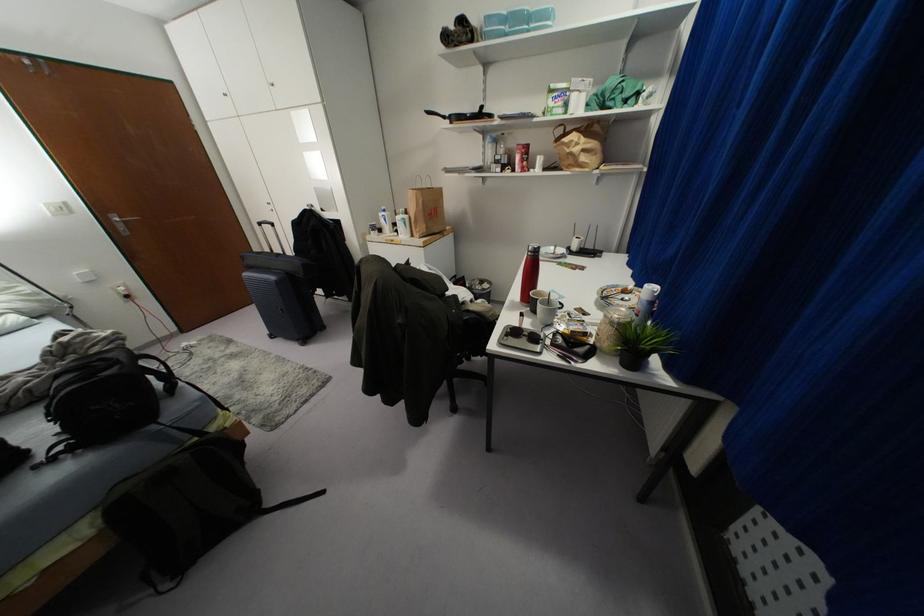
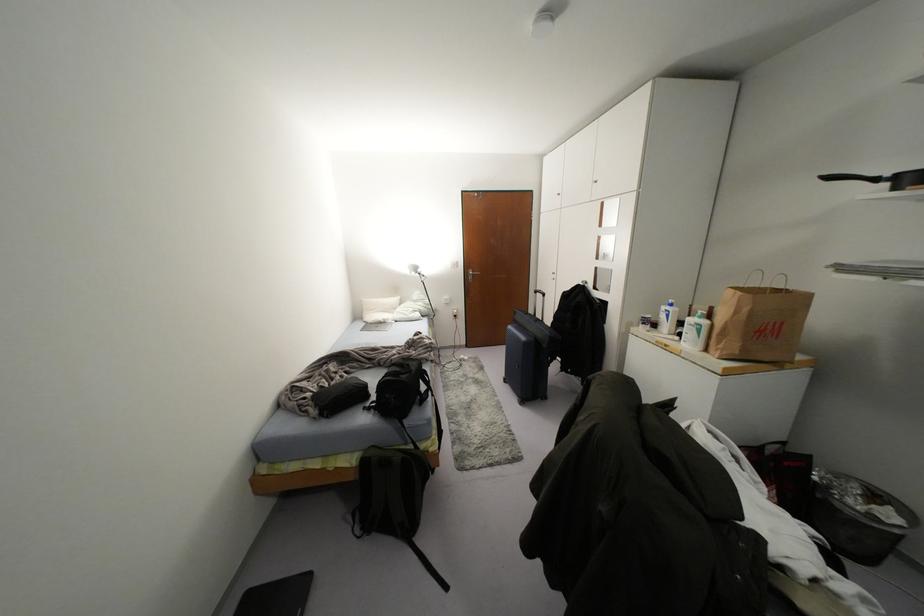
Question: The camera is either moving clockwise (left) or counter-clockwise (right) around the object. The first image is from the beginning of the video and the second image is from the end. Is the camera moving left or right when shooting the video?

Choices:
 (A) Left
 (B) Right

Answer: (B)